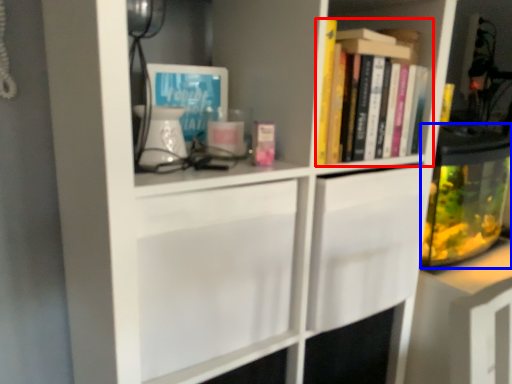
Question: Which of the following is the closest to the observer, book (highlighted by a red box) or glass jar (highlighted by a blue box)?

Choices:
 (A) book
 (B) glass jar

Answer: (A)